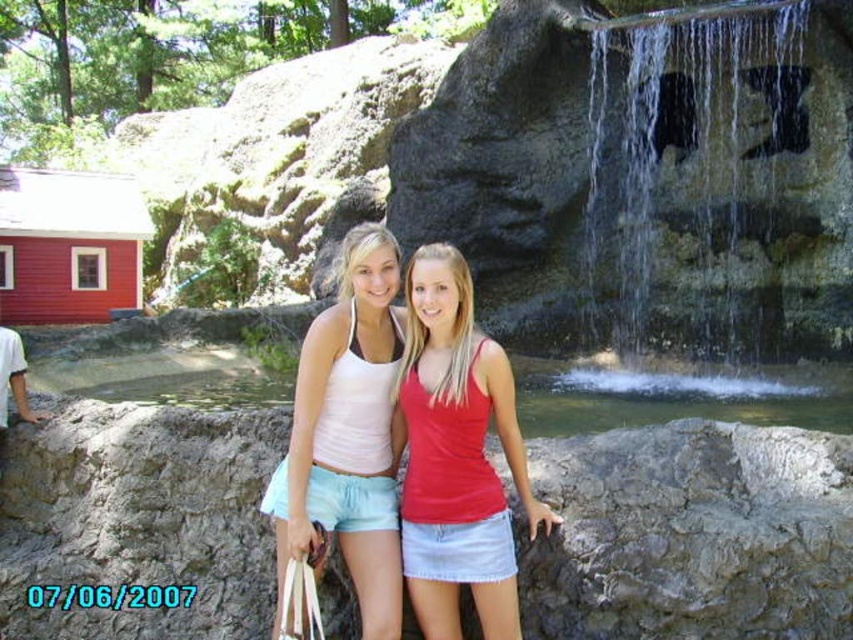
Which of these two, matte white tank top at center or white cotton shirt at left, stands shorter?

Standing shorter between the two is white cotton shirt at left.

Between matte white tank top at center and white cotton shirt at left, which one has more height?

matte white tank top at center

The image size is (853, 640). Describe the element at coordinates (347, 433) in the screenshot. I see `matte white tank top at center` at that location.

What are the coordinates of `matte white tank top at center` in the screenshot? It's located at (347, 433).

Based on the photo, is matte red tank top at center below white cotton shirt at left?

Yes, matte red tank top at center is below white cotton shirt at left.

Describe the element at coordinates (457, 456) in the screenshot. I see `matte red tank top at center` at that location.

The width and height of the screenshot is (853, 640). Find the location of `matte red tank top at center`. matte red tank top at center is located at coordinates (457, 456).

Which is more to the left, gray stone at center or matte red tank top at center?

gray stone at center is more to the left.

Does gray stone at center come in front of matte red tank top at center?

Yes, it is in front of matte red tank top at center.

Is point (688, 515) closer to viewer compared to point (437, 532)?

No, it is behind (437, 532).

The height and width of the screenshot is (640, 853). I want to click on gray stone at center, so click(691, 534).